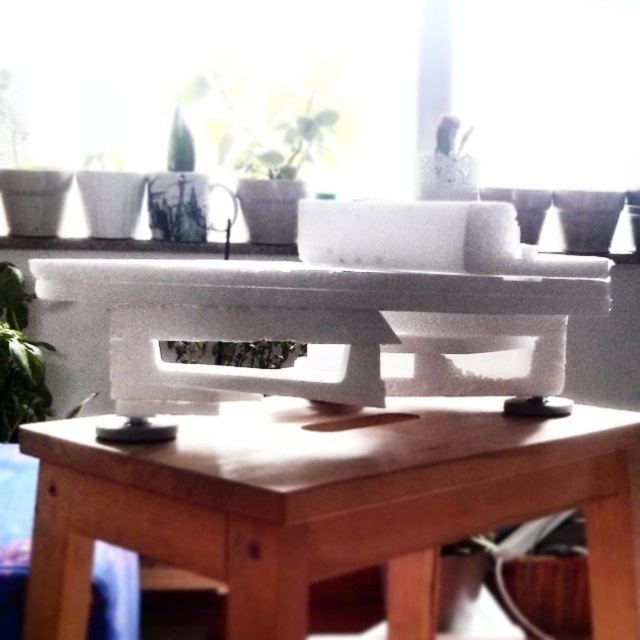
Question: Which point is closer to the camera?

Choices:
 (A) (193, 92)
 (B) (499, 67)

Answer: (A)

Question: Which object is the farthest from the transparent glass window at upper center?

Choices:
 (A) brown wooden table at center
 (B) green matte plant at lower left

Answer: (A)

Question: Does brown wooden table at center have a greater width compared to green matte plant at lower left?

Choices:
 (A) yes
 (B) no

Answer: (A)

Question: Which object is the farthest from the green matte plant at lower left?

Choices:
 (A) green matte plant at upper center
 (B) brown wooden table at center
 (C) transparent glass window at upper center

Answer: (C)

Question: Is green matte plant at lower left wider than green matte plant at upper center?

Choices:
 (A) yes
 (B) no

Answer: (B)

Question: Is brown wooden table at center further to the viewer compared to green matte plant at upper center?

Choices:
 (A) no
 (B) yes

Answer: (A)